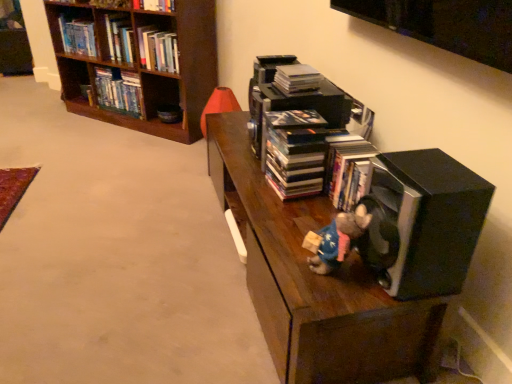
Question: From the image's perspective, is black matte speaker at lower right positioned above or below hardcover book at upper left, which is counted as the first book, starting from the back?

Choices:
 (A) above
 (B) below

Answer: (B)

Question: Considering their positions, is black matte speaker at lower right located in front of or behind hardcover book at upper left, which is counted as the first book, starting from the back?

Choices:
 (A) behind
 (B) front

Answer: (B)

Question: Which is farther from the hardcover books at left, which is counted as the second book, starting from the left?

Choices:
 (A) brown wooden bookcase at upper left
 (B) dark wood shelf at center
 (C) black matte book at center, positioned as the 4th book in top-to-bottom order
 (D) hardcover book at upper left, which ranks as the 1th book in top-to-bottom order
 (E) hardcover book at upper left, the second book in the top-to-bottom sequence

Answer: (C)

Question: Which is farther from the hardcover books at left, the 3th book viewed from the top?

Choices:
 (A) black matte speaker at lower right
 (B) dark wood shelf at center
 (C) hardcover book at upper left, the 3th book when ordered from bottom to top
 (D) black matte book at center, which is the 4th book in back-to-front order
 (E) hardcover book at upper left, arranged as the fourth book when viewed from the front

Answer: (A)